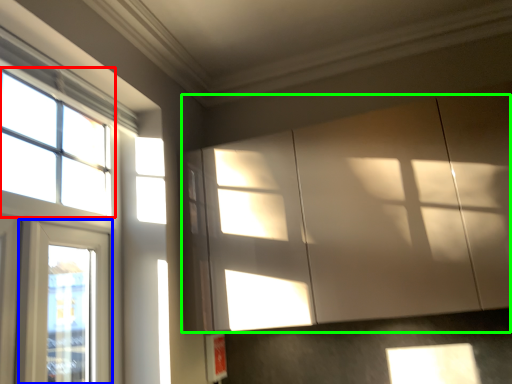
Question: Which object is the closest to the window (highlighted by a red box)? Choose among these: window (highlighted by a blue box) or cabinetry (highlighted by a green box).

Choices:
 (A) window
 (B) cabinetry

Answer: (A)